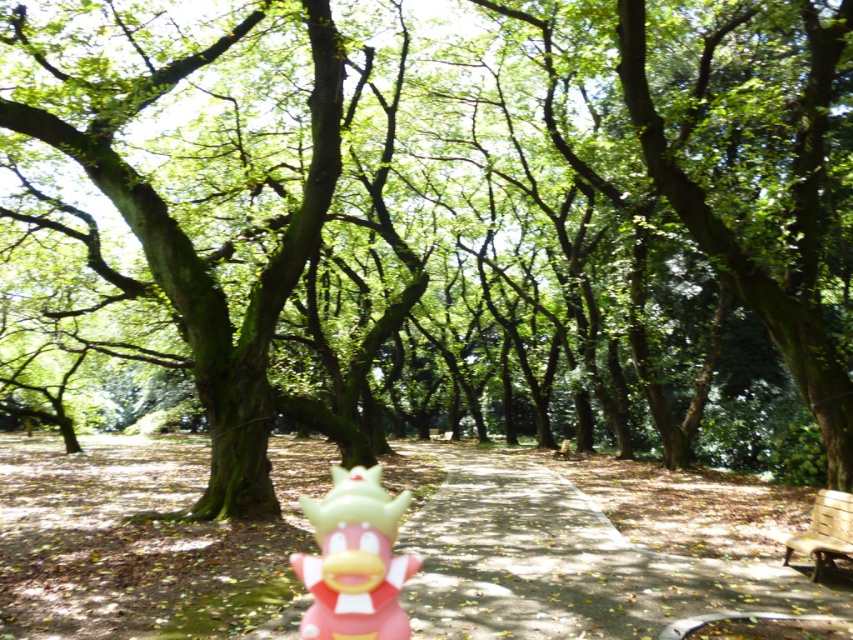
You are a child who wants to place the pink rubber toy at center on top of the wooden park bench at lower right. Can you do this without the toy falling off?

The pink rubber toy at center is shorter than the wooden park bench at lower right, so placing it on top might be possible as long as the bench has a flat surface large enough to support the toy. However, the height difference alone doesn